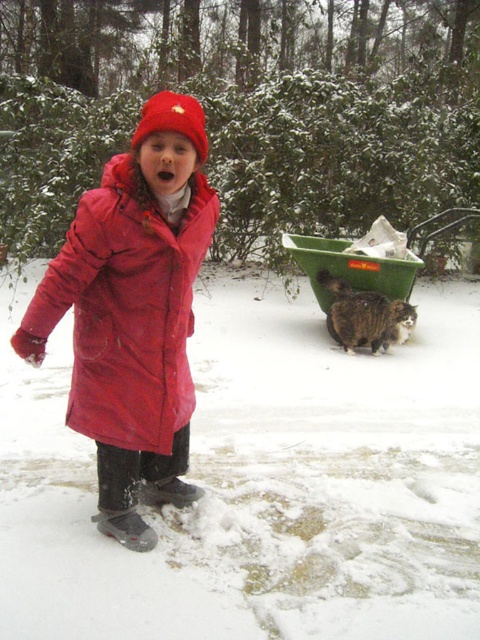
Who is higher up, green plastic cart at lower right or red fleece hat at center?

red fleece hat at center

Who is shorter, green plastic cart at lower right or red fleece hat at center?

With less height is red fleece hat at center.

Between point (324, 266) and point (192, 145), which one is positioned behind?

Positioned behind is point (324, 266).

Find the location of `green plastic cart at lower right`. green plastic cart at lower right is located at coordinates (368, 259).

Is point (115, 182) less distant than point (162, 104)?

No, (115, 182) is further to viewer.

Is point (95, 365) more distant than point (143, 120)?

Yes, point (95, 365) is behind point (143, 120).

The image size is (480, 640). Find the location of `matte red coat at center`. matte red coat at center is located at coordinates (126, 308).

Is matte red coat at center shorter than green plastic cart at lower right?

No, matte red coat at center is not shorter than green plastic cart at lower right.

Measure the distance between matte red coat at center and green plastic cart at lower right.

3.99 meters

Identify the location of matte red coat at center. (126, 308).